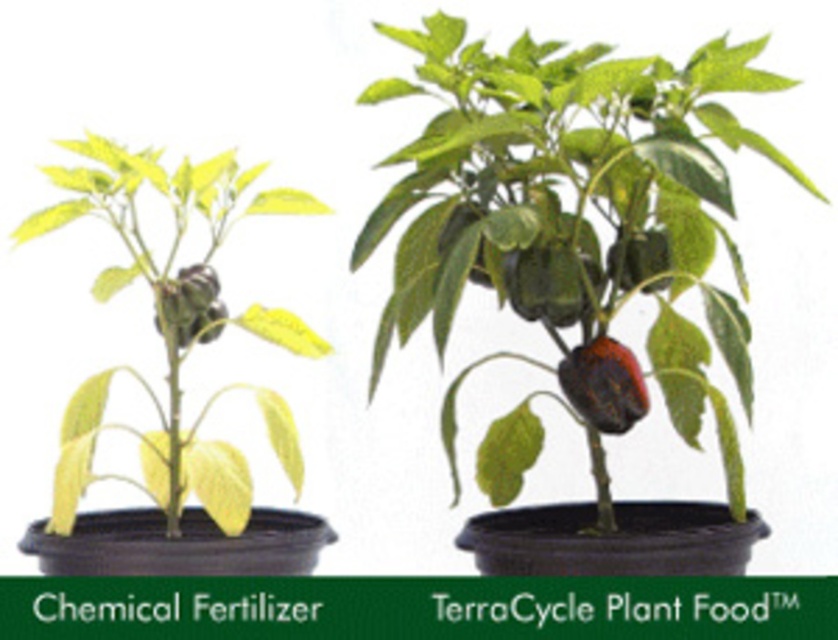
You are standing in front of the two potted plants and want to take a closer look at the fruits on both plants. Which fruit is physically closer to you, the one at point [691,84] or the one at point [647,250]?

The fruit at point [691,84] is closer to you than the fruit at point [647,250] because the former is described as being closer to the camera.

You are a gardener standing in front of two potted plants. You notice the yellow matte leafy plant at left and the shiny dark red pepper at center. Which object is nearer to you?

The yellow matte leafy plant at left is closer to the viewer than the shiny dark red pepper at center.

Looking at this image, you are a gardener inspecting two potted plants. The plant on the left used Chemical Fertilizer and has a green matte pepper at center and a green matte pepper at upper center. The plant on the right used TerraCycle Plant Food. Which plant has larger peppers? Please explain your reasoning based on the peppers you observe.

The plant on the left with Chemical Fertilizer has a larger green matte pepper at center compared to the green matte pepper at upper center. However, the TerraCycle Plant Food plant might be healthier overall as the Chemical Fertilizer plant shows signs of stress like pale leaves and underdeveloped fruits.